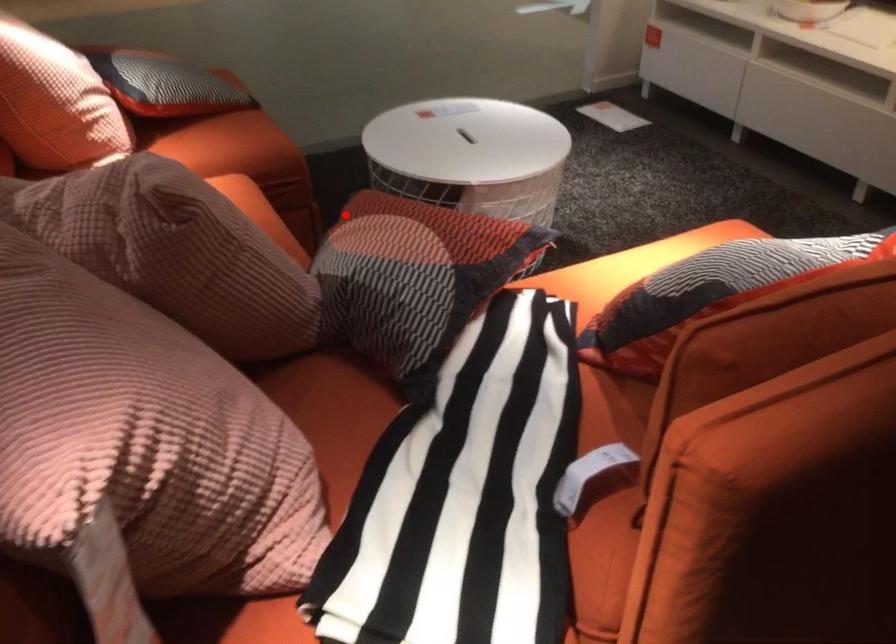
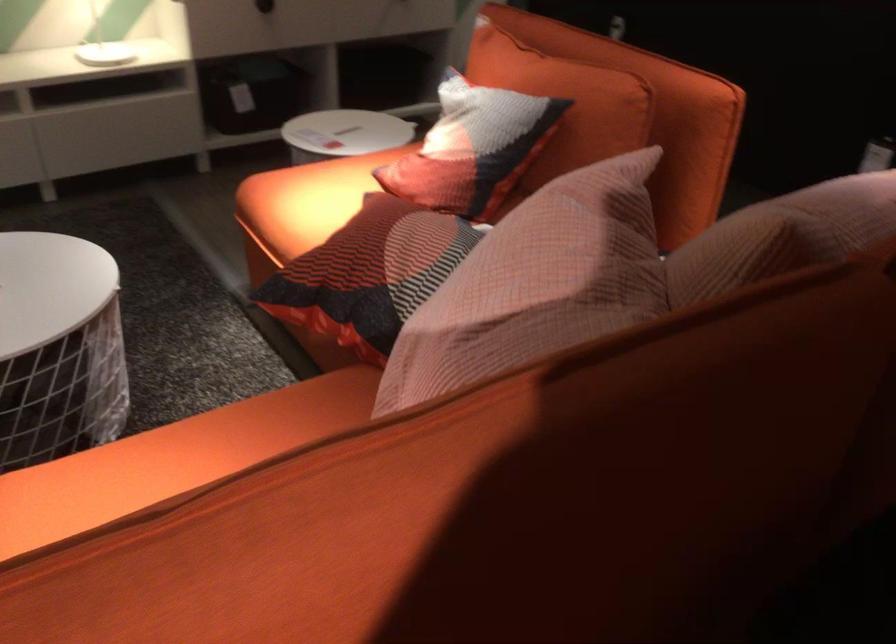
Where in the second image is the point corresponding to the highlighted location from the first image?

(369, 274)